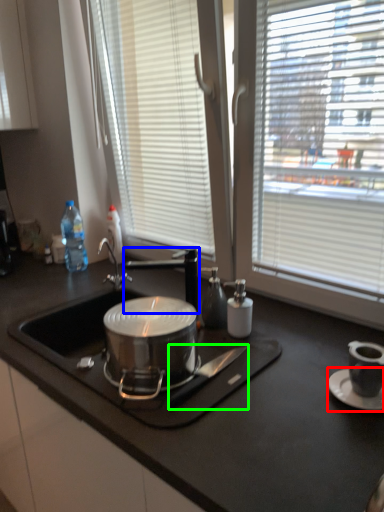
Question: Considering the real-world distances, which object is closest to saucer (highlighted by a red box)? tap (highlighted by a blue box) or knife (highlighted by a green box).

Choices:
 (A) tap
 (B) knife

Answer: (B)